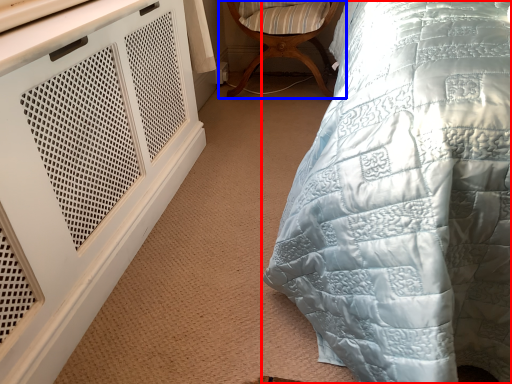
Question: Among these objects, which one is nearest to the camera, bed (highlighted by a red box) or chair (highlighted by a blue box)?

Choices:
 (A) bed
 (B) chair

Answer: (A)